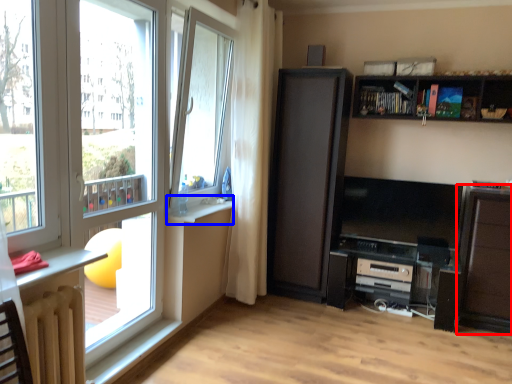
Question: Which point is closer to the camera, cabinetry (highlighted by a red box) or window sill (highlighted by a blue box)?

Choices:
 (A) cabinetry
 (B) window sill

Answer: (B)